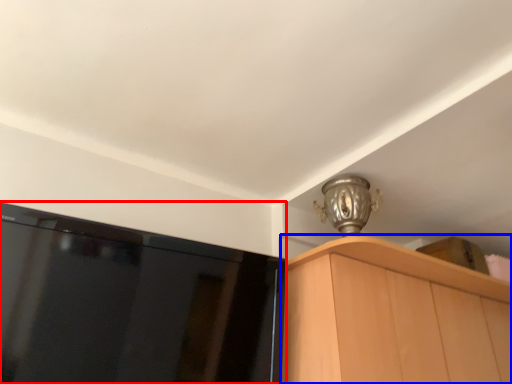
Question: Which object appears farthest to the camera in this image, screen (highlighted by a red box) or cabinetry (highlighted by a blue box)?

Choices:
 (A) screen
 (B) cabinetry

Answer: (B)